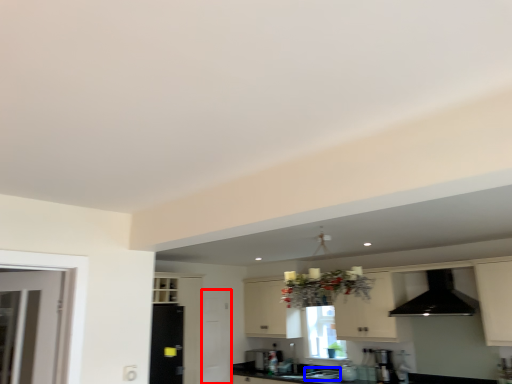
Question: Which point is further to the camera, screen door (highlighted by a red box) or sink (highlighted by a blue box)?

Choices:
 (A) screen door
 (B) sink

Answer: (A)